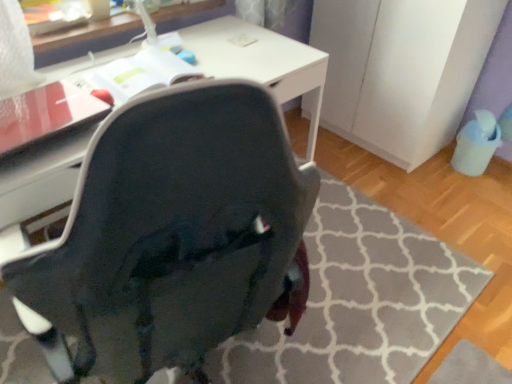
Question: Is the depth of white matte file cabinet at right less than that of matte black chair at center?

Choices:
 (A) no
 (B) yes

Answer: (A)

Question: Would you consider white matte file cabinet at right to be distant from matte black chair at center?

Choices:
 (A) yes
 (B) no

Answer: (A)

Question: Does white matte file cabinet at right have a smaller size compared to matte black chair at center?

Choices:
 (A) no
 (B) yes

Answer: (A)

Question: Considering the relative positions of white matte file cabinet at right and matte black chair at center in the image provided, is white matte file cabinet at right to the left of matte black chair at center from the viewer's perspective?

Choices:
 (A) no
 (B) yes

Answer: (A)

Question: From the image's perspective, would you say white matte file cabinet at right is positioned over matte black chair at center?

Choices:
 (A) no
 (B) yes

Answer: (B)

Question: Is white matte file cabinet at right at the right side of matte black chair at center?

Choices:
 (A) yes
 (B) no

Answer: (A)

Question: Could you tell me if matte black chair at center is turned towards white glossy table at upper center?

Choices:
 (A) yes
 (B) no

Answer: (B)

Question: Does matte black chair at center come in front of white glossy table at upper center?

Choices:
 (A) yes
 (B) no

Answer: (A)

Question: Can you confirm if matte black chair at center is positioned to the right of white glossy table at upper center?

Choices:
 (A) yes
 (B) no

Answer: (A)

Question: Considering the relative sizes of matte black chair at center and white glossy table at upper center in the image provided, is matte black chair at center smaller than white glossy table at upper center?

Choices:
 (A) no
 (B) yes

Answer: (A)

Question: From a real-world perspective, is matte black chair at center on white glossy table at upper center?

Choices:
 (A) yes
 (B) no

Answer: (B)

Question: Can you confirm if matte black chair at center is bigger than white glossy table at upper center?

Choices:
 (A) yes
 (B) no

Answer: (A)

Question: Is white matte file cabinet at right surrounded by matte black chair at center?

Choices:
 (A) yes
 (B) no

Answer: (B)